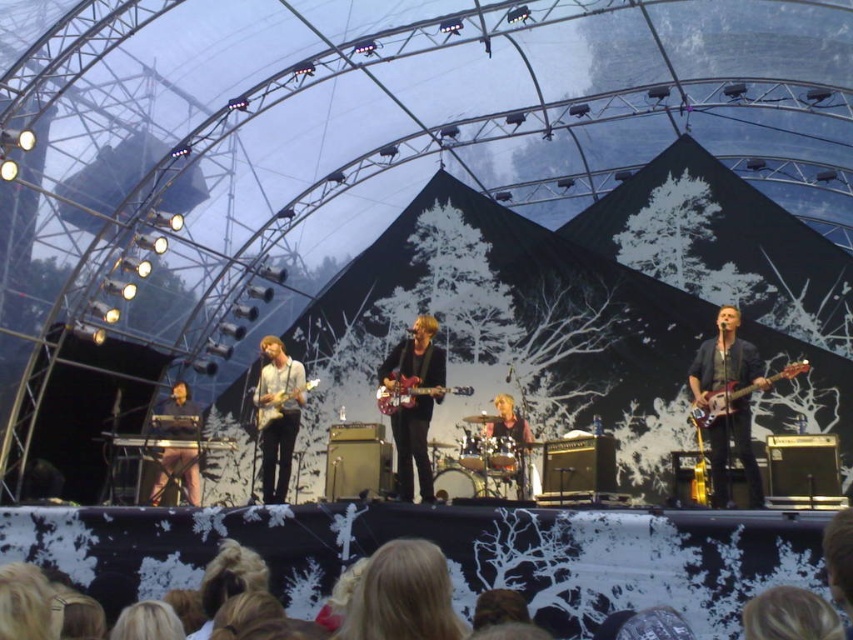
Is matte black guitar at center above matte white shirt at center?

Indeed, matte black guitar at center is positioned over matte white shirt at center.

Describe the element at coordinates (413, 445) in the screenshot. The width and height of the screenshot is (853, 640). I see `matte black guitar at center` at that location.

The image size is (853, 640). Identify the location of matte black guitar at center. (413, 445).

Is matte black guitar at center positioned in front of electric guitar at right?

No.

Which is above, matte black guitar at center or electric guitar at right?

electric guitar at right

Between point (430, 380) and point (701, 392), which one is positioned behind?

The point (430, 380) is more distant.

Locate an element on the screen. The image size is (853, 640). matte black guitar at center is located at coordinates (413, 445).

Is dark blue denim jacket at right bigger than glossy wood guitar at center?

Yes, dark blue denim jacket at right is bigger than glossy wood guitar at center.

Is point (701, 390) farther from viewer compared to point (384, 396)?

No, (701, 390) is closer to viewer.

What do you see at coordinates (724, 360) in the screenshot? The height and width of the screenshot is (640, 853). I see `dark blue denim jacket at right` at bounding box center [724, 360].

The width and height of the screenshot is (853, 640). I want to click on dark blue denim jacket at right, so click(x=724, y=360).